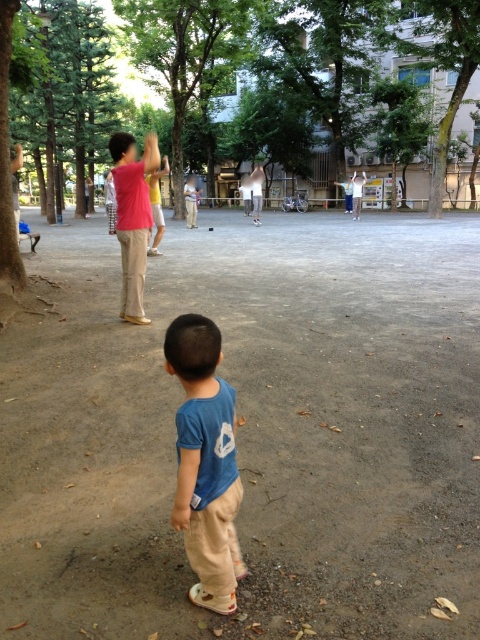
Is blue cotton shirt at center above light brown wood bench at center?

No, blue cotton shirt at center is not above light brown wood bench at center.

Does point (206, 452) lie in front of point (364, 177)?

Yes, point (206, 452) is closer to viewer.

Locate an element on the screen. This screenshot has width=480, height=640. blue cotton shirt at center is located at coordinates (204, 461).

Consider the image. Who is shorter, brown dirt field at center or green leafy tree at upper center?

With less height is brown dirt field at center.

Who is positioned more to the left, brown dirt field at center or green leafy tree at upper center?

From the viewer's perspective, brown dirt field at center appears more on the left side.

Find the location of `brown dirt field at center`. brown dirt field at center is located at coordinates (251, 432).

Between point (132, 60) and point (180, 496), which one is positioned in front?

Point (180, 496) is in front.

Looking at this image, is green leafy tree at upper center to the left of blue cotton shirt at center from the viewer's perspective?

Incorrect, green leafy tree at upper center is not on the left side of blue cotton shirt at center.

Is point (476, 49) in front of point (215, 328)?

No, it is behind (215, 328).

At what (x,y) coordinates should I click in order to perform the action: click on green leafy tree at upper center. Please return your answer as a coordinate pair (x, y). The image size is (480, 640). Looking at the image, I should click on (444, 64).